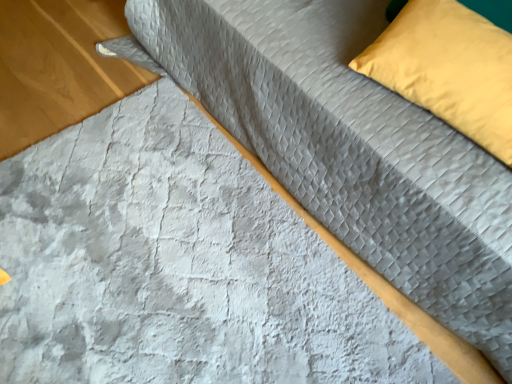
This screenshot has height=384, width=512. What do you see at coordinates (449, 69) in the screenshot?
I see `yellow fabric pillow at upper right` at bounding box center [449, 69].

The image size is (512, 384). I want to click on yellow fabric pillow at upper right, so click(449, 69).

Identify the location of yellow fabric pillow at upper right. (449, 69).